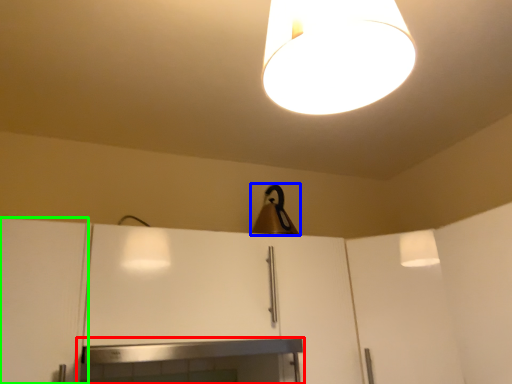
Question: Considering the real-world distances, which object is farthest from fireplace (highlighted by a red box)? lamp (highlighted by a blue box) or cabinetry (highlighted by a green box)?

Choices:
 (A) lamp
 (B) cabinetry

Answer: (A)